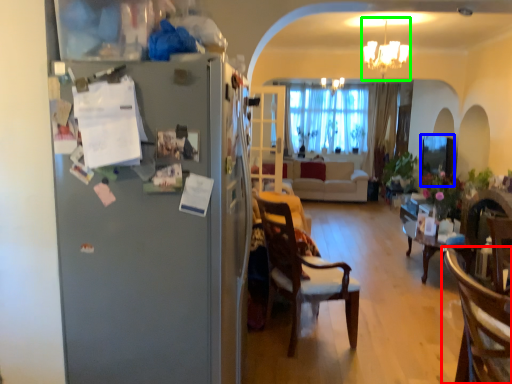
Question: Estimate the real-world distances between objects in this image. Which object is farther from chair (highlighted by a red box), window screen (highlighted by a blue box) or light fixture (highlighted by a green box)?

Choices:
 (A) window screen
 (B) light fixture

Answer: (B)